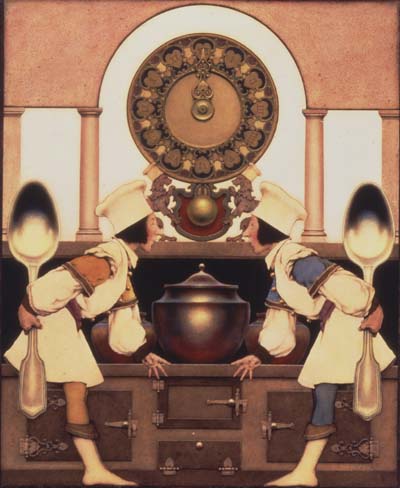
Locate an element on the screen. pot is located at coordinates (199, 345).